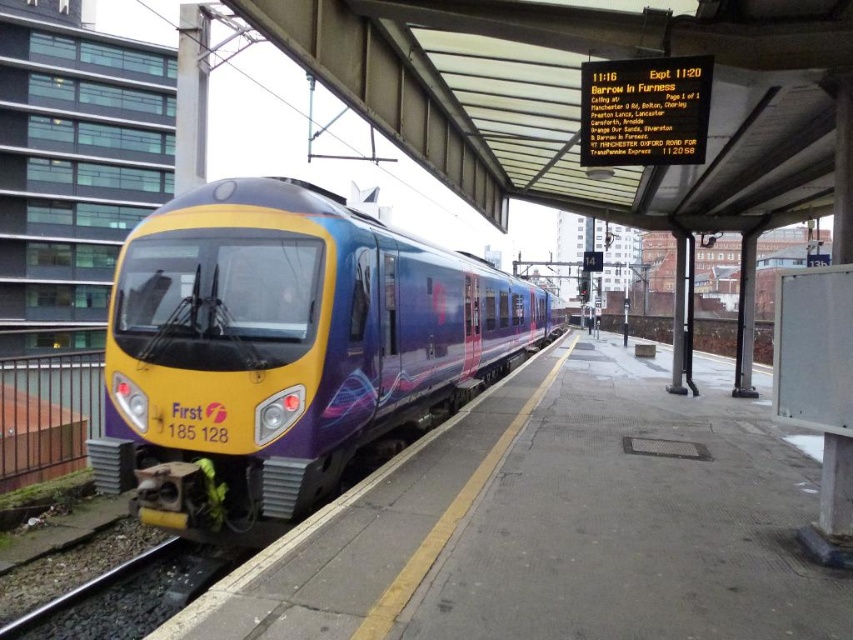
Question: Observing the image, what is the correct spatial positioning of concrete platform at center in reference to black gravel train track at lower left?

Choices:
 (A) below
 (B) above

Answer: (B)

Question: Among these points, which one is farthest from the camera?

Choices:
 (A) (177, 568)
 (B) (352, 369)

Answer: (B)

Question: In this image, where is concrete platform at center located relative to black gravel train track at lower left?

Choices:
 (A) below
 (B) above

Answer: (B)

Question: Is concrete platform at center positioned in front of matte purple train at center?

Choices:
 (A) yes
 (B) no

Answer: (A)

Question: Among these objects, which one is nearest to the camera?

Choices:
 (A) black gravel train track at lower left
 (B) concrete platform at center

Answer: (B)

Question: Among these objects, which one is farthest from the camera?

Choices:
 (A) black gravel train track at lower left
 (B) matte purple train at center

Answer: (B)